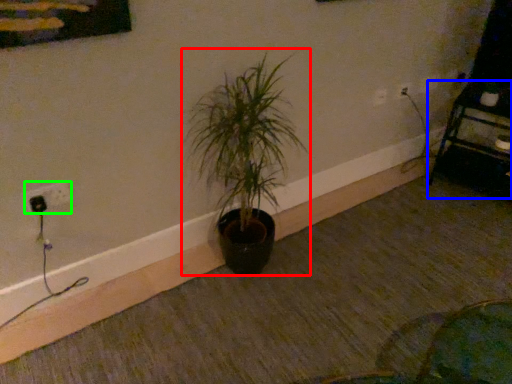
Question: Which object is the farthest from houseplant (highlighted by a red box)? Choose among these: furniture (highlighted by a blue box) or electric outlet (highlighted by a green box).

Choices:
 (A) furniture
 (B) electric outlet

Answer: (A)